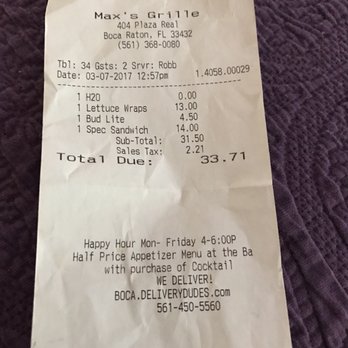
In order to click on table number in this screenshot , I will do `click(82, 62)`.